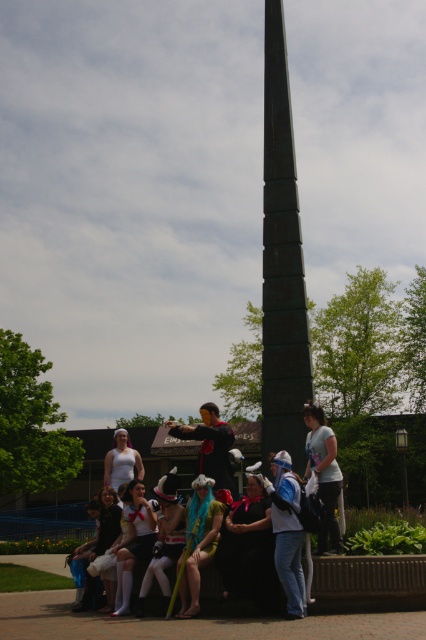
Who is positioned more to the right, denim jeans at lower center or turquoise fabric dress at center?

denim jeans at lower center is more to the right.

Between denim jeans at lower center and turquoise fabric dress at center, which one has more height?

denim jeans at lower center is taller.

Between point (293, 488) and point (212, 480), which one is positioned in front?

Point (293, 488) is in front.

This screenshot has width=426, height=640. I want to click on denim jeans at lower center, so click(x=287, y=531).

Image resolution: width=426 pixels, height=640 pixels. What do you see at coordinates (249, 548) in the screenshot?
I see `black satin dress at center` at bounding box center [249, 548].

Can you confirm if black satin dress at center is bigger than black fabric dress at lower left?

Yes, black satin dress at center is bigger than black fabric dress at lower left.

Locate an element on the screen. The image size is (426, 640). black satin dress at center is located at coordinates (249, 548).

Does turquoise fabric dress at center have a lesser width compared to white matte cosplay outfit at center?

No.

Looking at this image, is turquoise fabric dress at center to the left of white matte cosplay outfit at center from the viewer's perspective?

No, turquoise fabric dress at center is not to the left of white matte cosplay outfit at center.

Where is `turquoise fabric dress at center`? Image resolution: width=426 pixels, height=640 pixels. turquoise fabric dress at center is located at coordinates (199, 541).